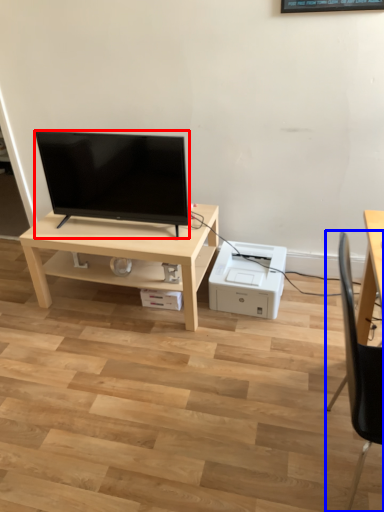
Question: Which point is further to the camera, television (highlighted by a red box) or chair (highlighted by a blue box)?

Choices:
 (A) television
 (B) chair

Answer: (A)